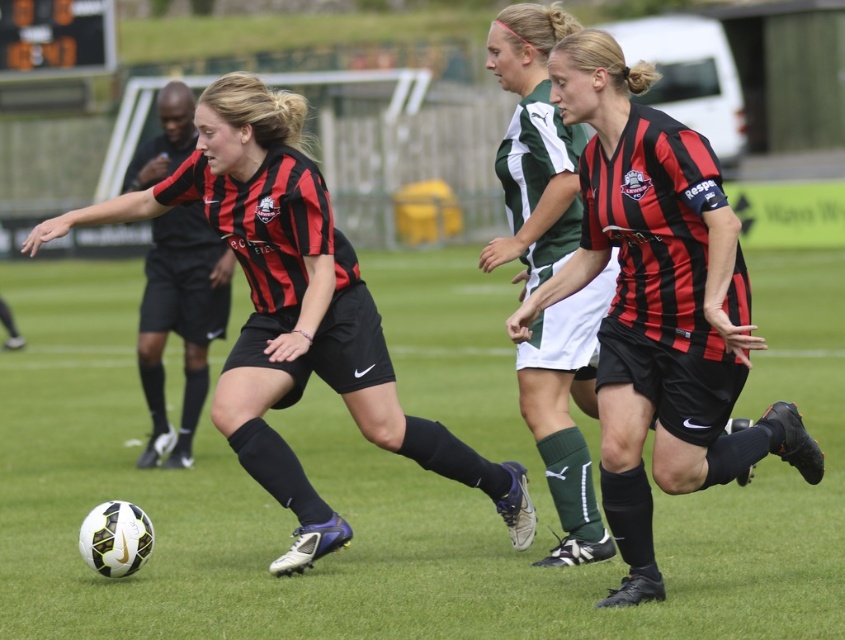
Is matte black jersey at center to the right of black matte referee at center from the viewer's perspective?

Yes, matte black jersey at center is to the right of black matte referee at center.

Can you confirm if matte black jersey at center is thinner than black matte referee at center?

No.

Where is `matte black jersey at center`? matte black jersey at center is located at coordinates (658, 305).

Looking at this image, does green artificial turf at center appear over black matte referee at center?

Actually, green artificial turf at center is below black matte referee at center.

Is point (180, 470) closer to viewer compared to point (157, 296)?

That is True.

Is point (535, 554) closer to camera compared to point (144, 152)?

Yes.

Find the location of a particular element. green artificial turf at center is located at coordinates (396, 481).

Looking at this image, does green artificial turf at center appear on the right side of matte black soccer ball at lower left?

Yes, green artificial turf at center is to the right of matte black soccer ball at lower left.

Is the position of green artificial turf at center less distant than that of matte black soccer ball at lower left?

Yes, it is.

Between point (44, 580) and point (308, 330), which one is positioned behind?

The point (44, 580) is behind.

The height and width of the screenshot is (640, 845). I want to click on green artificial turf at center, so click(396, 481).